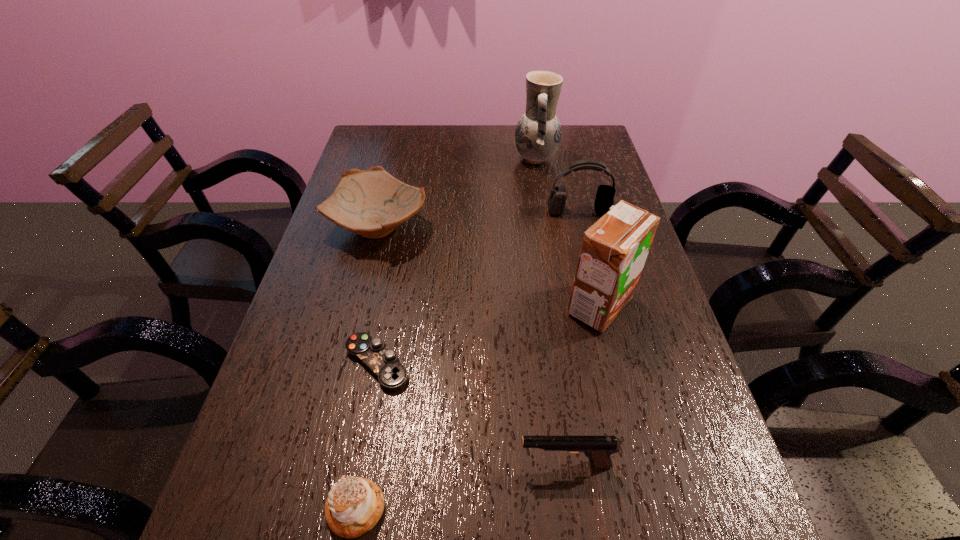
You are a GUI agent. You are given a task and a screenshot of the screen. Output one action in this format:
    pyautogui.click(x=<x>, y=<y>)
    Task: Click on the free space located on either side of the right pottery
    The width and height of the screenshot is (960, 540).
    Given the screenshot: What is the action you would take?
    pyautogui.click(x=409, y=159)

Where is `vacant point located on either side of the right pottery`? The image size is (960, 540). vacant point located on either side of the right pottery is located at coordinates click(x=433, y=159).

The height and width of the screenshot is (540, 960). What are the coordinates of `vacant region located on the straw side of the carton` in the screenshot? It's located at (427, 306).

Identify the location of vacant area situated 0.370m on the straw side of the carton. (400, 306).

Identify the location of vacant position located 0.050m on the straw side of the carton. (542, 306).

What are the coordinates of `free space located on the headband of the headset` in the screenshot? It's located at (x=585, y=234).

At what (x,y) coordinates should I click in order to perform the action: click on vacant space situated 0.330m on the front of the left pottery. Please return your answer as a coordinate pair (x, y). The image size is (960, 540). Looking at the image, I should click on (342, 375).

This screenshot has width=960, height=540. What are the coordinates of `vacant position located at the muzzle of the pistol` in the screenshot? It's located at (401, 464).

Where is `vacant area situated at the muzzle of the pistol`? vacant area situated at the muzzle of the pistol is located at coordinates (348, 464).

Image resolution: width=960 pixels, height=540 pixels. Identify the location of free space located at the muzzle of the pistol. (389, 464).